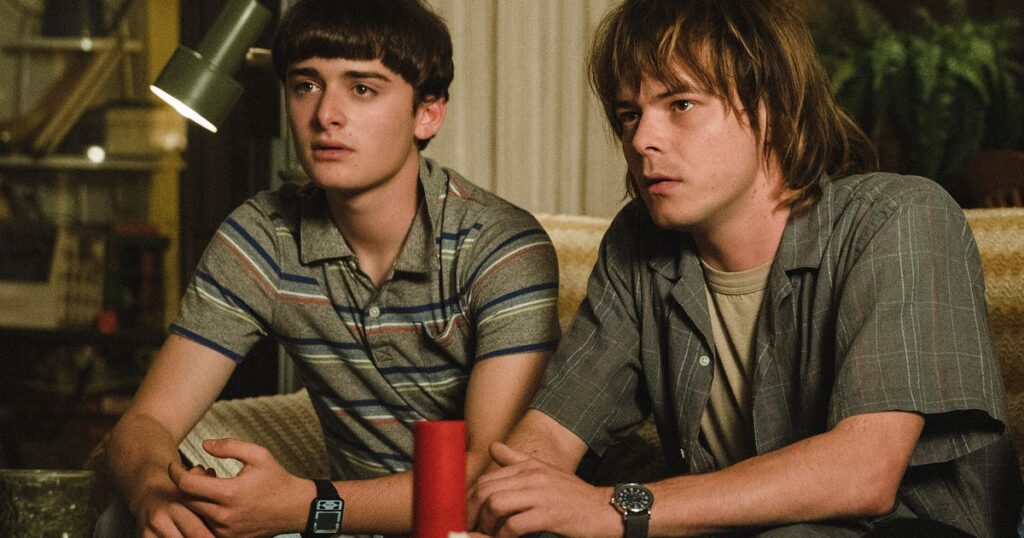
Find the location of `dark green lamp`. dark green lamp is located at coordinates (217, 56).